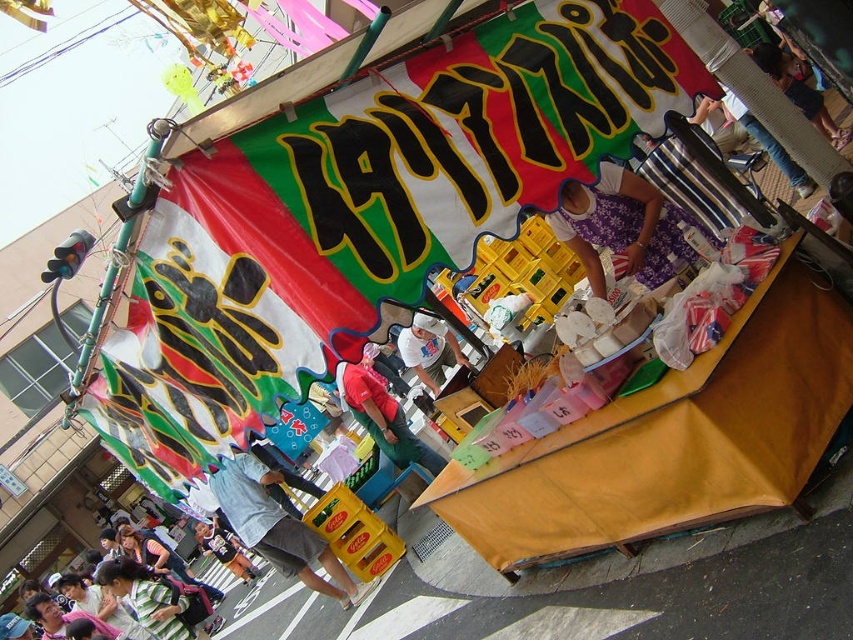
You are a customer at the market and want to buy both the purple fabric dress at center and the denim shorts at lower left. Which item is displayed higher up on the stall?

The purple fabric dress at center is displayed higher up on the stall than the denim shorts at lower left.

You are standing at the entrance of the market stall and want to reach both the point at coordinates point (589, 276) and point (401, 328). Which point should you approach first if you want to reach them in order from closest to farthest?

You should approach point (589, 276) first because it is closer to you than point (401, 328).